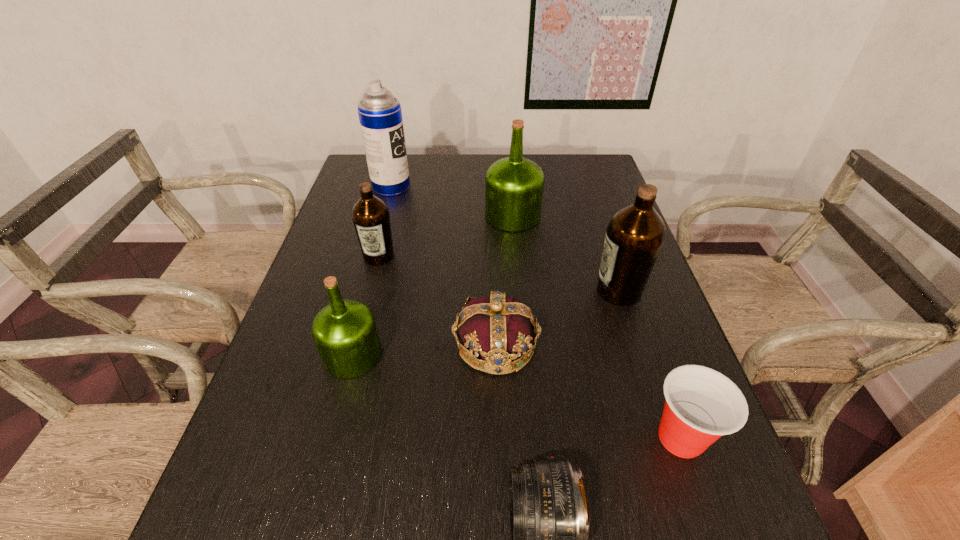
Identify the location of free location located 0.050m on the front of the purple crown. (497, 401).

At what (x,y) coordinates should I click in order to perform the action: click on free spot located on the left of the second nearest object. Please return your answer as a coordinate pair (x, y). The image size is (960, 540). Looking at the image, I should click on (565, 438).

At what (x,y) coordinates should I click in order to perform the action: click on object positioned at the far edge. Please return your answer as a coordinate pair (x, y). The width and height of the screenshot is (960, 540). Looking at the image, I should click on (380, 115).

Locate an element on the screen. aerosol can present at the left edge is located at coordinates (380, 115).

Locate an element on the screen. Image resolution: width=960 pixels, height=540 pixels. olive oil present at the right edge is located at coordinates pyautogui.click(x=634, y=237).

Where is `cup at the right edge`? The height and width of the screenshot is (540, 960). cup at the right edge is located at coordinates (701, 405).

Locate an element on the screen. The height and width of the screenshot is (540, 960). object that is at the far left corner is located at coordinates [380, 115].

Image resolution: width=960 pixels, height=540 pixels. In the image, there is a desktop. Find the location of `vacant space at the far edge`. vacant space at the far edge is located at coordinates (457, 169).

Where is `vacant space at the left edge of the desktop`? vacant space at the left edge of the desktop is located at coordinates (320, 437).

In the image, there is a desktop. In order to click on blank space at the right edge in this screenshot , I will do `click(659, 377)`.